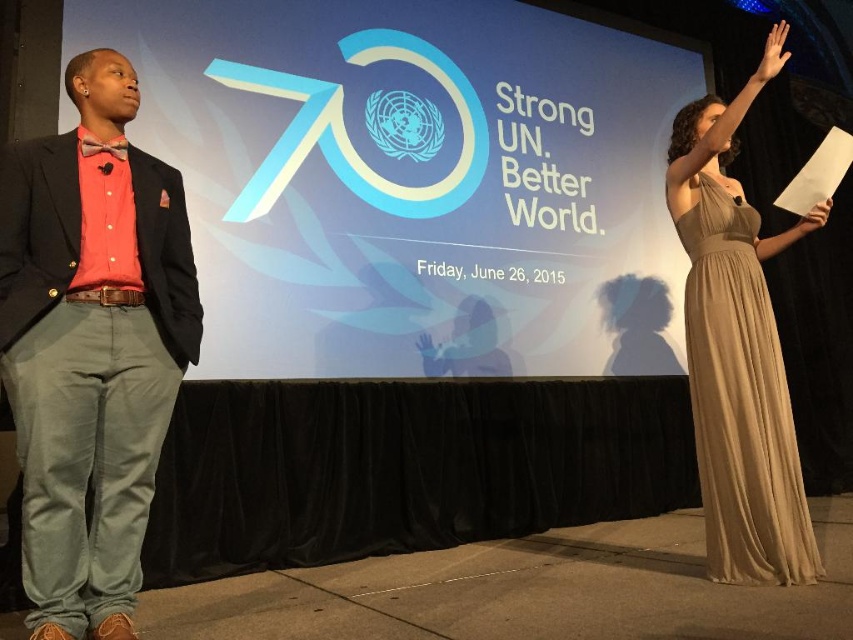
You are an event photographer who needs to capture a clear shot of both the satin beige dress at right and the matte skin hand at upper right. Since you want to ensure both are in focus, which object should you focus on first to account for their size difference?

The satin beige dress at right is taller than the matte skin hand at upper right. To ensure both are in focus, you should focus on the satin beige dress at right first as it is larger and requires more precise focus.

You are an event coordinator arranging a photo shoot for the stage setup. The photographer wants to position a light source to the right of the brushed cotton suit at left to highlight the speaker. Given the coordinates provided in the Objects Description, where should the light be placed relative to the suit?

The light should be placed to the right of the brushed cotton suit at left since the suit is located at point (91, 346), and the photographer wants the light to the right of that position.